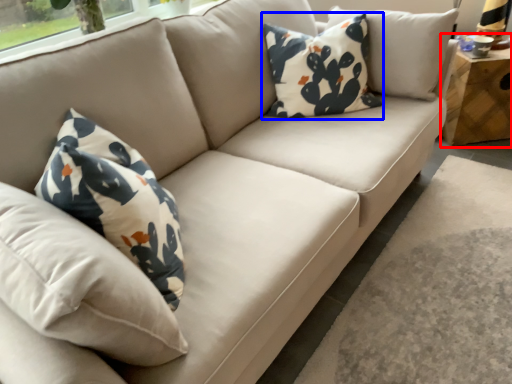
Question: Which of the following is the closest to the observer, table (highlighted by a red box) or pillow (highlighted by a blue box)?

Choices:
 (A) table
 (B) pillow

Answer: (B)